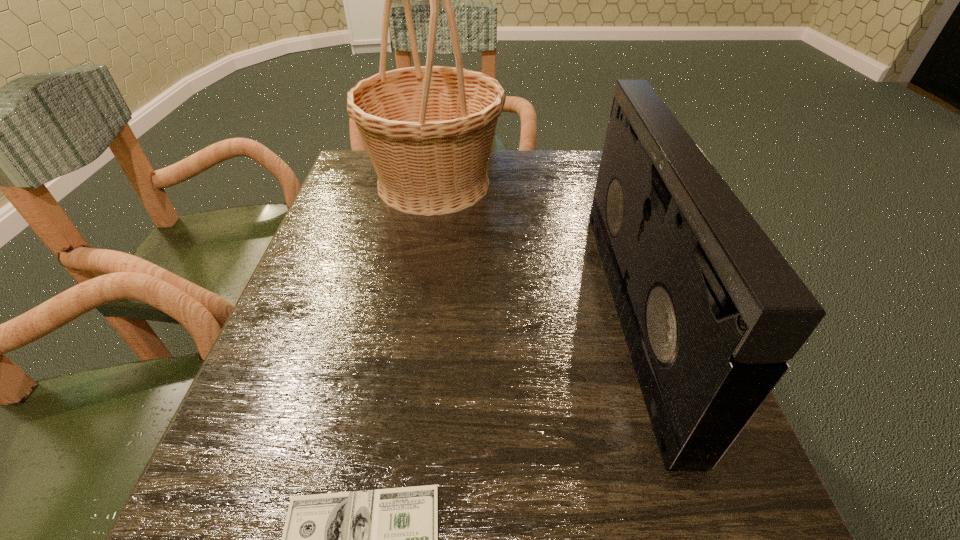
The width and height of the screenshot is (960, 540). Identify the location of the tallest object. (428, 130).

Where is `the second tallest object`? The width and height of the screenshot is (960, 540). the second tallest object is located at coordinates (710, 309).

What are the coordinates of `the rightmost object` in the screenshot? It's located at (710, 309).

Where is `free space located 0.160m on the right of the basket`? Image resolution: width=960 pixels, height=540 pixels. free space located 0.160m on the right of the basket is located at coordinates (566, 184).

This screenshot has height=540, width=960. I want to click on blank space located on the front side of the videotape, so click(x=533, y=313).

Where is `free space located 0.180m on the front side of the videotape`? free space located 0.180m on the front side of the videotape is located at coordinates (516, 313).

Identify the location of vacant area located 0.250m on the front side of the videotape. (476, 313).

At what (x,y) coordinates should I click in order to perform the action: click on object present at the far edge. Please return your answer as a coordinate pair (x, y). Image resolution: width=960 pixels, height=540 pixels. Looking at the image, I should click on (428, 130).

The image size is (960, 540). Find the location of `object that is at the left edge`. object that is at the left edge is located at coordinates (428, 130).

This screenshot has width=960, height=540. Identify the location of object that is positioned at the right edge. (710, 309).